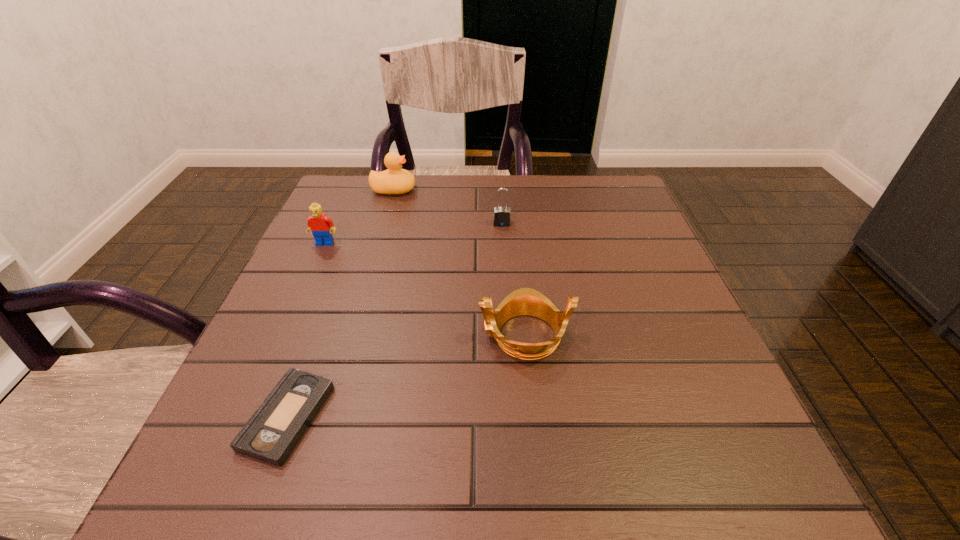
Find the location of a particular element. The image size is (960, 540). free space between the second nearest object and the Lego is located at coordinates (425, 289).

Identify the location of vacant area that lies between the fourth nearest object and the farthest object. (447, 207).

Image resolution: width=960 pixels, height=540 pixels. What are the coordinates of `free point between the third nearest object and the duck` in the screenshot? It's located at (359, 217).

Find the location of a particular element. Image resolution: width=960 pixels, height=540 pixels. vacant region between the Lego and the fourth farthest object is located at coordinates (425, 289).

Find the location of a particular element. empty location between the fourth farthest object and the farthest object is located at coordinates (459, 262).

What are the coordinates of `free spot between the shortest object and the Lego` in the screenshot? It's located at pyautogui.click(x=306, y=330).

At what (x,y) coordinates should I click in order to perform the action: click on unoccupied area between the tiara and the nearest object. Please return your answer as a coordinate pair (x, y). The width and height of the screenshot is (960, 540). Looking at the image, I should click on (406, 376).

What are the coordinates of `the second closest object to the Lego` in the screenshot? It's located at (270, 435).

Identify which object is the closest to the nearest object. Please provide its 2D coordinates. Your answer should be formatted as a tuple, i.e. [(x, y)], where the tuple contains the x and y coordinates of a point satisfying the conditions above.

[(525, 301)]

I want to click on vacant space that satisfies the following two spatial constraints: 1. on the face of the duck; 2. on the face of the Lego, so click(378, 243).